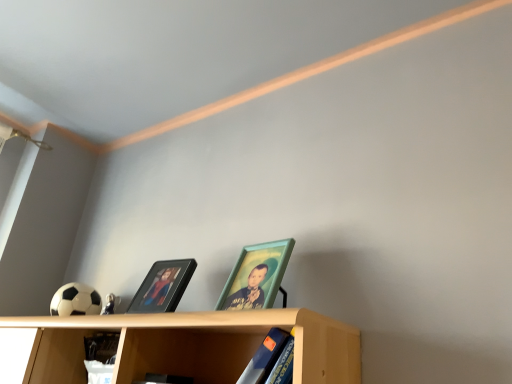
Question: Does blue matte book at lower center have a larger size compared to light wood shelf at lower center?

Choices:
 (A) yes
 (B) no

Answer: (B)

Question: Would you consider blue matte book at lower center to be distant from light wood shelf at lower center?

Choices:
 (A) yes
 (B) no

Answer: (B)

Question: Does blue matte book at lower center lie behind light wood shelf at lower center?

Choices:
 (A) no
 (B) yes

Answer: (B)

Question: Does blue matte book at lower center appear on the right side of light wood shelf at lower center?

Choices:
 (A) yes
 (B) no

Answer: (A)

Question: From a real-world perspective, is blue matte book at lower center on top of light wood shelf at lower center?

Choices:
 (A) yes
 (B) no

Answer: (B)

Question: From a real-world perspective, is teal wooden picture frame at center, the first picture frame from the right, positioned above or below black glossy picture frame at center, marked as the first picture frame in a left-to-right arrangement?

Choices:
 (A) below
 (B) above

Answer: (B)

Question: From the image's perspective, is teal wooden picture frame at center, positioned as the 2th picture frame in left-to-right order, positioned above or below black glossy picture frame at center, marked as the first picture frame in a left-to-right arrangement?

Choices:
 (A) above
 (B) below

Answer: (A)

Question: Based on their positions, is teal wooden picture frame at center, the first picture frame from the right, located to the left or right of black glossy picture frame at center, marked as the first picture frame in a left-to-right arrangement?

Choices:
 (A) right
 (B) left

Answer: (A)

Question: In the image, is teal wooden picture frame at center, positioned as the 2th picture frame in left-to-right order, positioned in front of or behind black glossy picture frame at center, the 2th picture frame viewed from the right?

Choices:
 (A) front
 (B) behind

Answer: (A)

Question: From a real-world perspective, is light wood shelf at lower center above or below blue matte book at lower center?

Choices:
 (A) above
 (B) below

Answer: (A)

Question: In the image, is light wood shelf at lower center positioned in front of or behind blue matte book at lower center?

Choices:
 (A) front
 (B) behind

Answer: (A)

Question: Is light wood shelf at lower center inside or outside of blue matte book at lower center?

Choices:
 (A) outside
 (B) inside

Answer: (A)

Question: Based on their sizes in the image, would you say light wood shelf at lower center is bigger or smaller than blue matte book at lower center?

Choices:
 (A) big
 (B) small

Answer: (A)

Question: Is teal wooden picture frame at center, the first picture frame from the right, taller or shorter than blue matte book at lower center?

Choices:
 (A) tall
 (B) short

Answer: (A)

Question: In terms of width, does teal wooden picture frame at center, positioned as the 2th picture frame in left-to-right order, look wider or thinner when compared to blue matte book at lower center?

Choices:
 (A) wide
 (B) thin

Answer: (B)